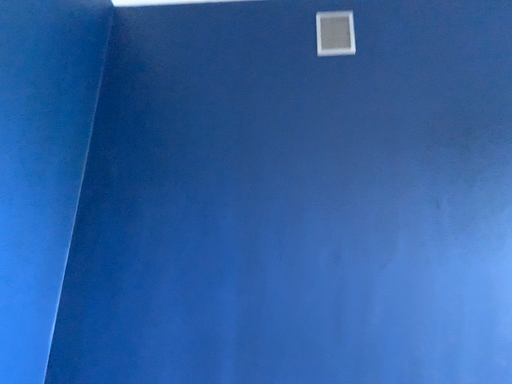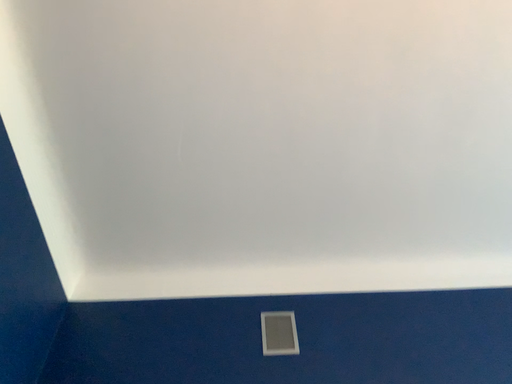
Question: How did the camera likely rotate when shooting the video?

Choices:
 (A) rotated upward
 (B) rotated downward

Answer: (A)